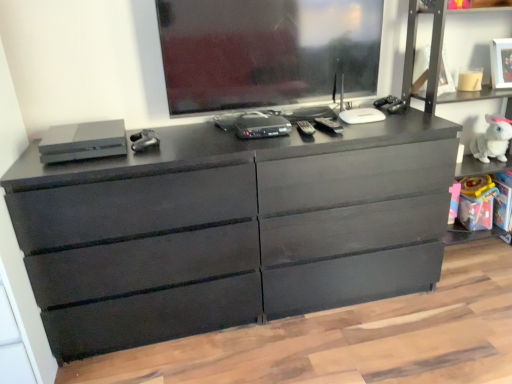
Question: From a real-world perspective, is black plastic remote control at center, which ranks as the third equipment in left-to-right order, over matte black dresser at right?

Choices:
 (A) no
 (B) yes

Answer: (B)

Question: Is black plastic remote control at center, which ranks as the third equipment in left-to-right order, bigger than matte black dresser at right?

Choices:
 (A) no
 (B) yes

Answer: (A)

Question: Is black plastic remote control at center, which ranks as the third equipment in left-to-right order, closer to the viewer compared to matte black dresser at right?

Choices:
 (A) no
 (B) yes

Answer: (B)

Question: Does black plastic remote control at center, which ranks as the third equipment in left-to-right order, have a lesser height compared to matte black dresser at right?

Choices:
 (A) no
 (B) yes

Answer: (B)

Question: Is black plastic remote control at center, which ranks as the third equipment in left-to-right order, not close to matte black dresser at right?

Choices:
 (A) no
 (B) yes

Answer: (A)

Question: Is black plastic remote control at center, the 1th equipment when ordered from right to left, outside of matte black dresser at right?

Choices:
 (A) yes
 (B) no

Answer: (A)

Question: Would you say white plush rabbit at right contains white matte picture frame at upper right?

Choices:
 (A) yes
 (B) no

Answer: (B)

Question: Considering the relative positions of white plush rabbit at right and white matte picture frame at upper right in the image provided, is white plush rabbit at right behind white matte picture frame at upper right?

Choices:
 (A) yes
 (B) no

Answer: (A)

Question: Is white plush rabbit at right taller than white matte picture frame at upper right?

Choices:
 (A) yes
 (B) no

Answer: (B)

Question: From the image's perspective, is white plush rabbit at right on top of white matte picture frame at upper right?

Choices:
 (A) yes
 (B) no

Answer: (B)

Question: Can you confirm if white plush rabbit at right is shorter than white matte picture frame at upper right?

Choices:
 (A) no
 (B) yes

Answer: (B)

Question: Is white plush rabbit at right bigger than white matte picture frame at upper right?

Choices:
 (A) no
 (B) yes

Answer: (B)

Question: From the image's perspective, is satin gray console at left, marked as the 3th equipment in a right-to-left arrangement, on top of white plush rabbit at right?

Choices:
 (A) no
 (B) yes

Answer: (A)